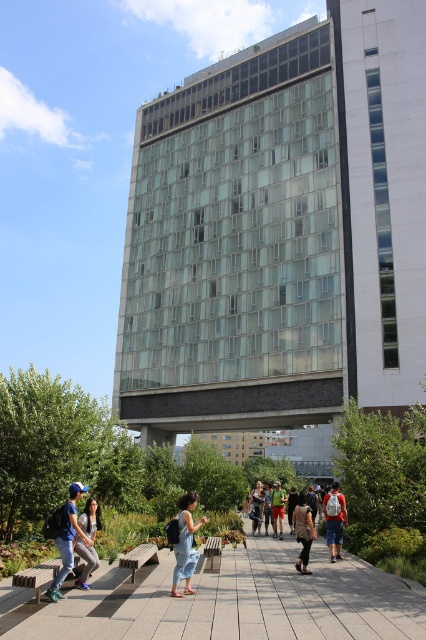
Question: Is matte blue cap at lower left to the left of green fabric shorts at center from the viewer's perspective?

Choices:
 (A) yes
 (B) no

Answer: (A)

Question: Does light gray concrete pavement at center have a lesser width compared to denim dress at center?

Choices:
 (A) no
 (B) yes

Answer: (A)

Question: Which point is farther to the camera?

Choices:
 (A) red backpack at center
 (B) denim dress at center
 (C) light gray concrete pavement at center

Answer: (A)

Question: Which point appears closest to the camera in this image?

Choices:
 (A) (x=282, y=525)
 (B) (x=330, y=524)
 (C) (x=367, y=625)

Answer: (C)

Question: Does matte blue cap at lower left appear under red backpack at center?

Choices:
 (A) yes
 (B) no

Answer: (B)

Question: Estimate the real-world distances between objects in this image. Which object is closer to the denim pants at lower left?

Choices:
 (A) denim dress at center
 (B) light gray concrete pavement at center

Answer: (A)